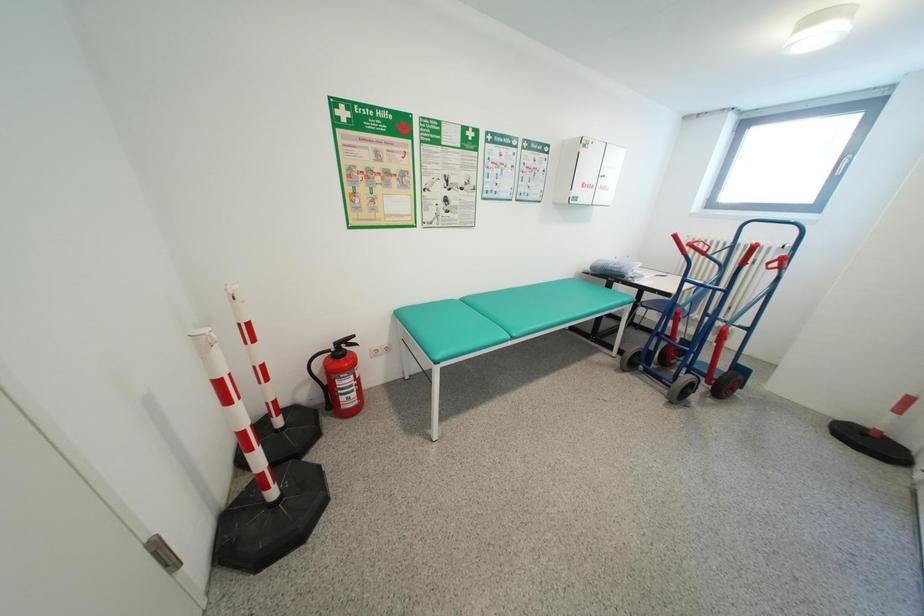
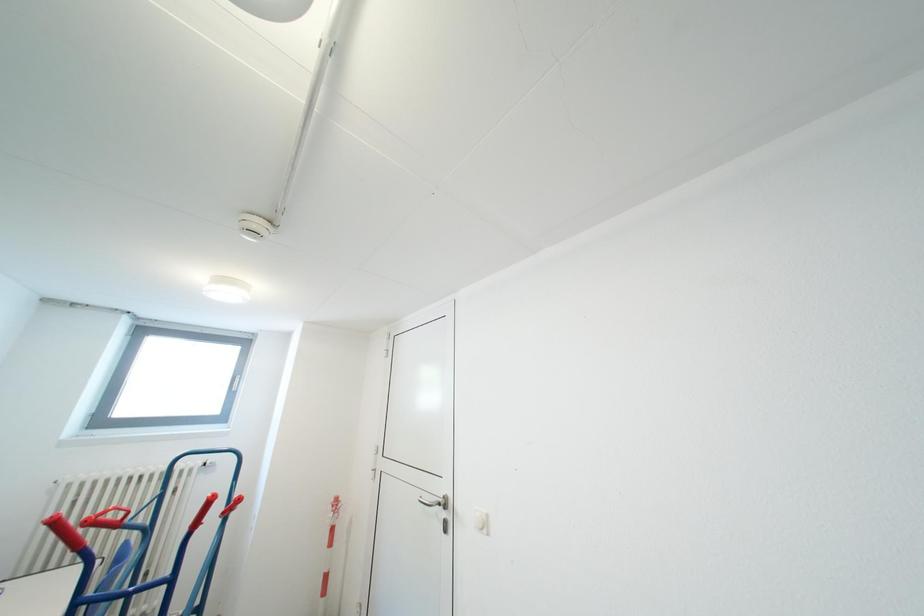
Question: The camera is either moving clockwise (left) or counter-clockwise (right) around the object. The first image is from the beginning of the video and the second image is from the end. Is the camera moving left or right when shooting the video?

Choices:
 (A) Left
 (B) Right

Answer: (A)